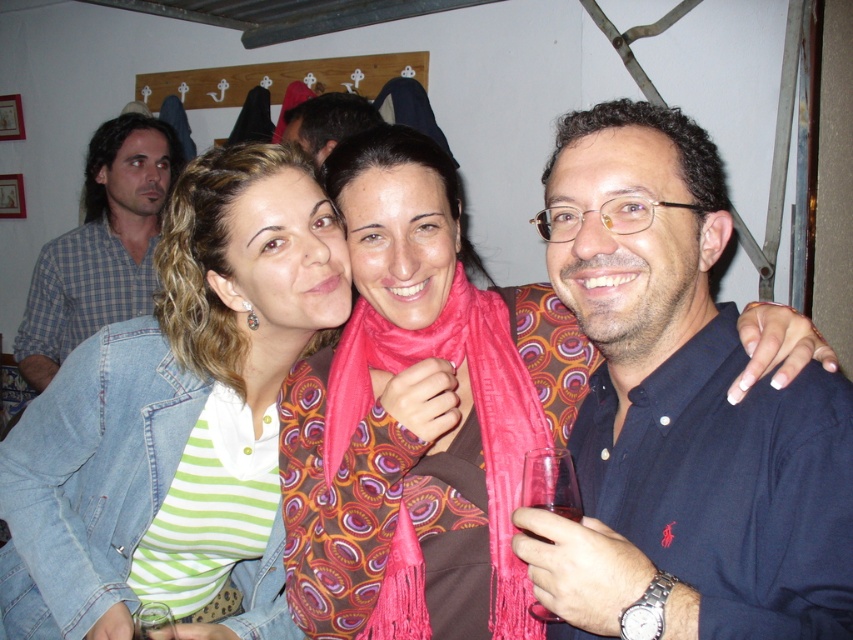
Between point (590, 145) and point (416, 627), which one is positioned in front?

Point (590, 145) is in front.

Is dark blue shirt at right thinner than pink woven scarf at center?

No, dark blue shirt at right is not thinner than pink woven scarf at center.

The width and height of the screenshot is (853, 640). Identify the location of dark blue shirt at right. tap(680, 410).

Which is behind, point (228, 186) or point (48, 280)?

Positioned behind is point (48, 280).

Locate an element on the screen. This screenshot has height=640, width=853. denim jacket at left is located at coordinates (152, 390).

Which is more to the left, pink woven scarf at center or dark brown hair at center?

Positioned to the left is dark brown hair at center.

Which is in front, point (421, 636) or point (320, 124)?

Point (421, 636) is more forward.

Find the location of `pink woven scarf at center`. pink woven scarf at center is located at coordinates (473, 406).

Image resolution: width=853 pixels, height=640 pixels. What are the coordinates of `pink woven scarf at center` in the screenshot? It's located at [473, 406].